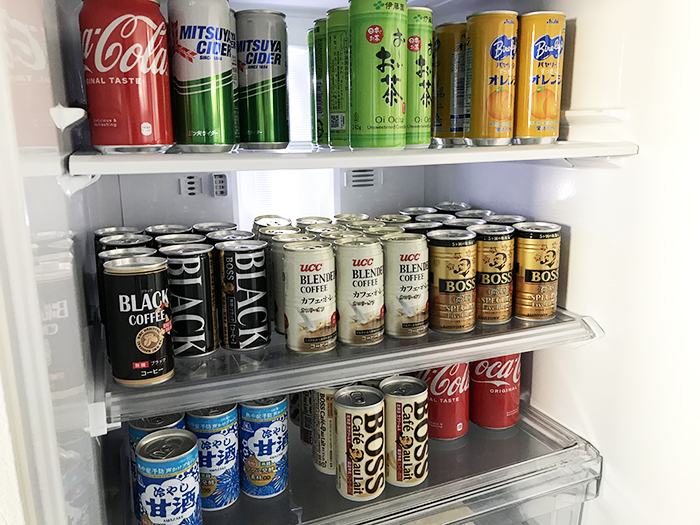
This screenshot has height=525, width=700. I want to click on light, so click(281, 194).